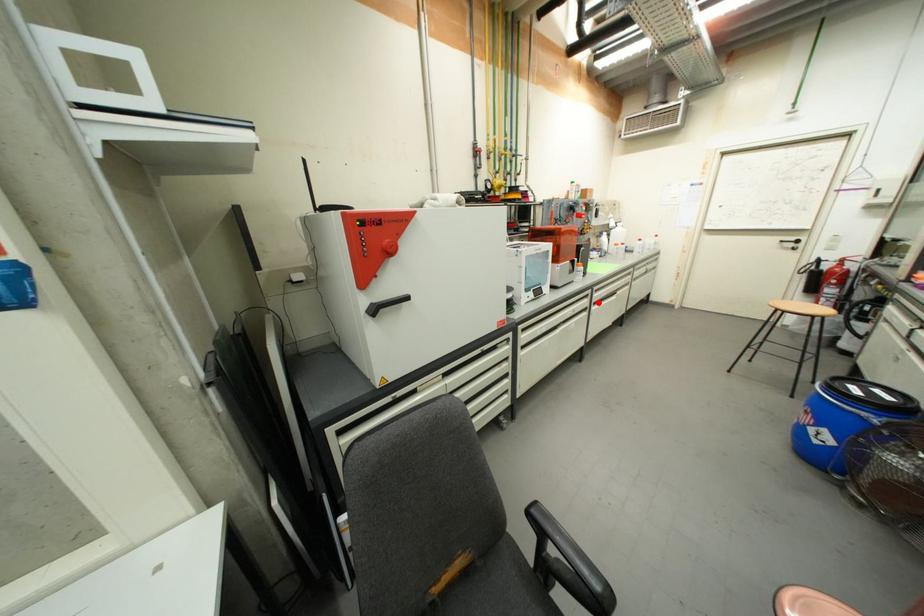
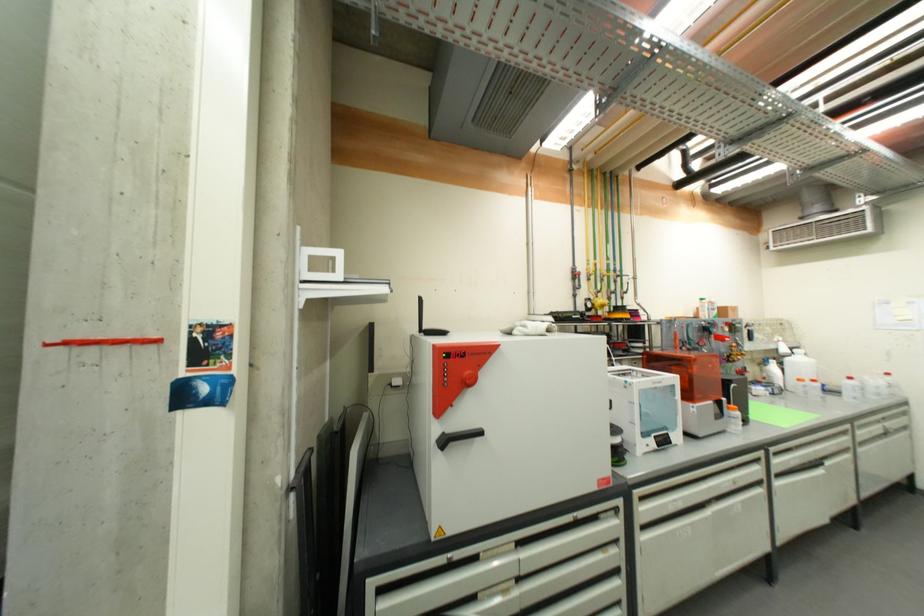
Where in the second image is the point corresponding to the highlighted location from the first image?

(779, 472)